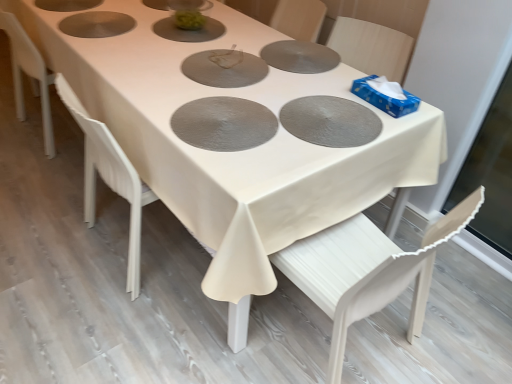
This screenshot has width=512, height=384. I want to click on vacant region to the left of matte gray pizza pan at center, which ranks as the third pizza pan in bottom-to-top order, so click(x=146, y=57).